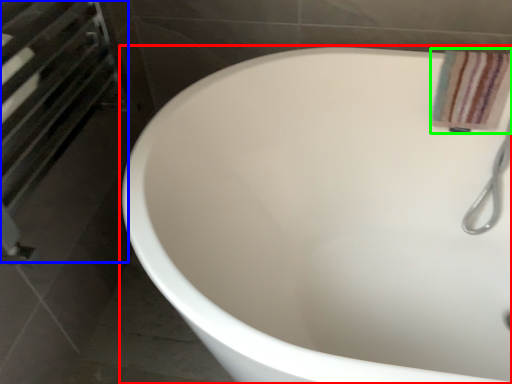
Question: Which object is positioned farthest from bathtub (highlighted by a red box)? Select from screen door (highlighted by a blue box) and bath towel (highlighted by a green box).

Choices:
 (A) screen door
 (B) bath towel

Answer: (A)